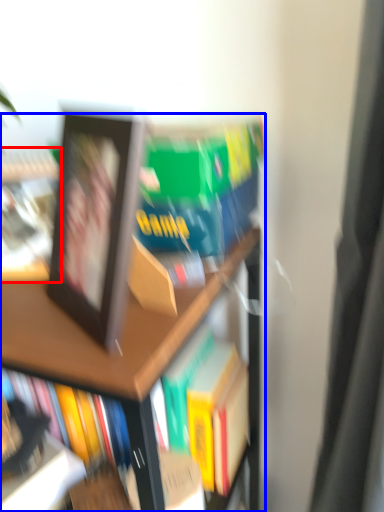
Question: Which object appears farthest to the camera in this image, book (highlighted by a red box) or bookcase (highlighted by a blue box)?

Choices:
 (A) book
 (B) bookcase

Answer: (A)